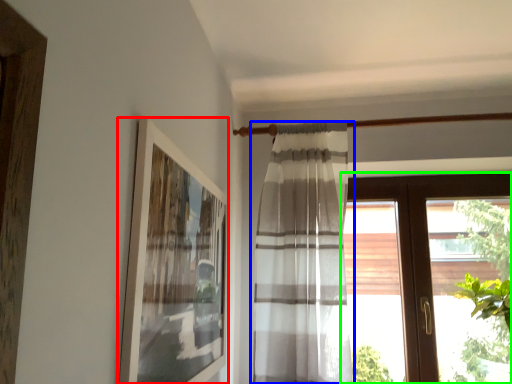
Question: Considering the real-world distances, which object is closest to picture frame (highlighted by a red box)? curtain (highlighted by a blue box) or window (highlighted by a green box).

Choices:
 (A) curtain
 (B) window

Answer: (A)